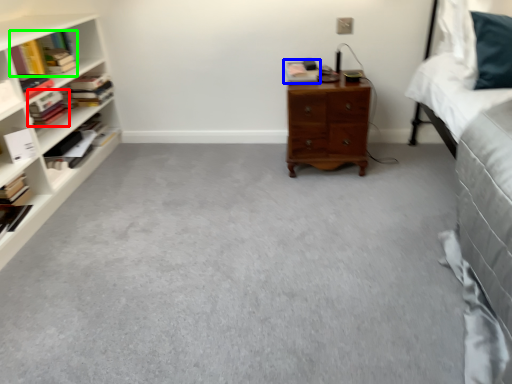
Question: Based on their relative distances, which object is nearer to book (highlighted by a red box)? Choose from book (highlighted by a blue box) and book (highlighted by a green box).

Choices:
 (A) book
 (B) book

Answer: (B)